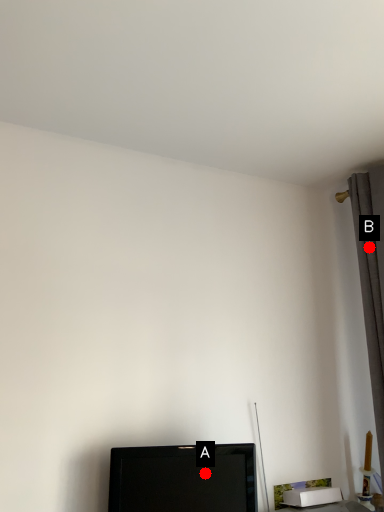
Question: Two points are circled on the image, labeled by A and B beside each circle. Among these points, which one is farthest from the camera?

Choices:
 (A) A is further
 (B) B is further

Answer: (B)